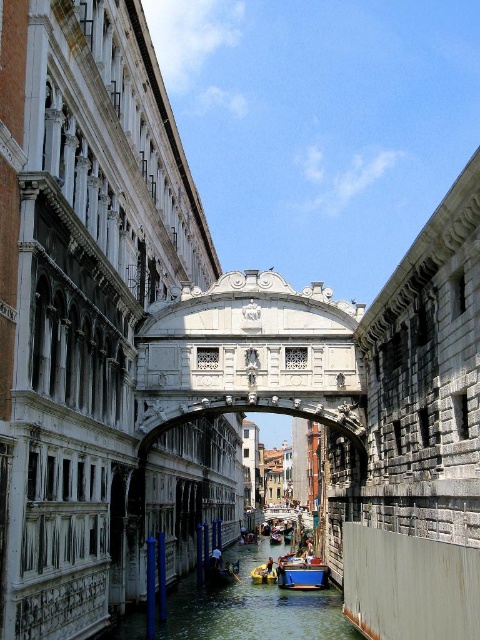
Question: Does greenish water at center appear on the left side of blue matte boat at center?

Choices:
 (A) yes
 (B) no

Answer: (A)

Question: Which object is closer to the camera taking this photo?

Choices:
 (A) blue matte boat at center
 (B) greenish water at center

Answer: (B)

Question: In this image, where is greenish water at center located relative to blue matte boat at center?

Choices:
 (A) left
 (B) right

Answer: (A)

Question: Is greenish water at center further to the viewer compared to blue matte boat at center?

Choices:
 (A) yes
 (B) no

Answer: (B)

Question: Which point is farther to the camera?

Choices:
 (A) [x=211, y=630]
 (B) [x=299, y=570]

Answer: (B)